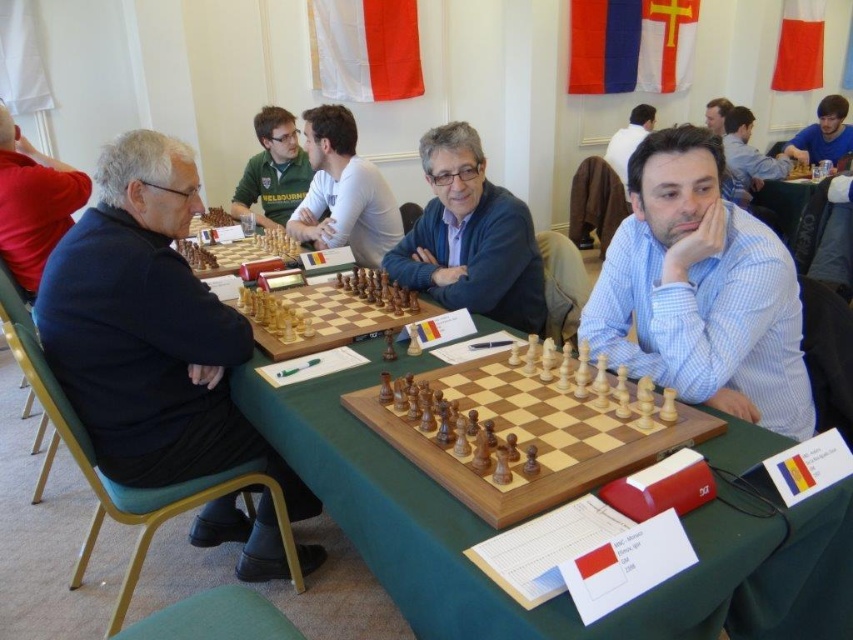
You are a photographer standing in the room and want to take a photo of both the black fabric jacket at left and the matte black jacket at left. Which jacket should you focus on first to ensure both are in the frame?

The black fabric jacket at left is much taller than the matte black jacket at left, so you should focus on the taller one first to ensure both are in the frame.

You are a chess player sitting at the table and need to place a chess piece at the point labeled point (727,349). Is this point closer to you or further away compared to point (12,225)?

Point (727,349) is in front of point (12,225), so it is closer to you.